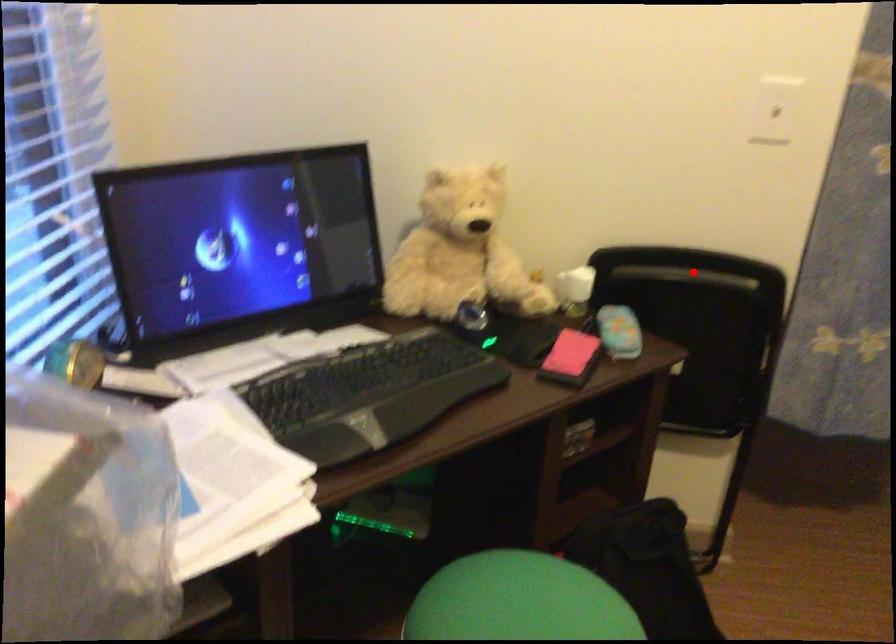
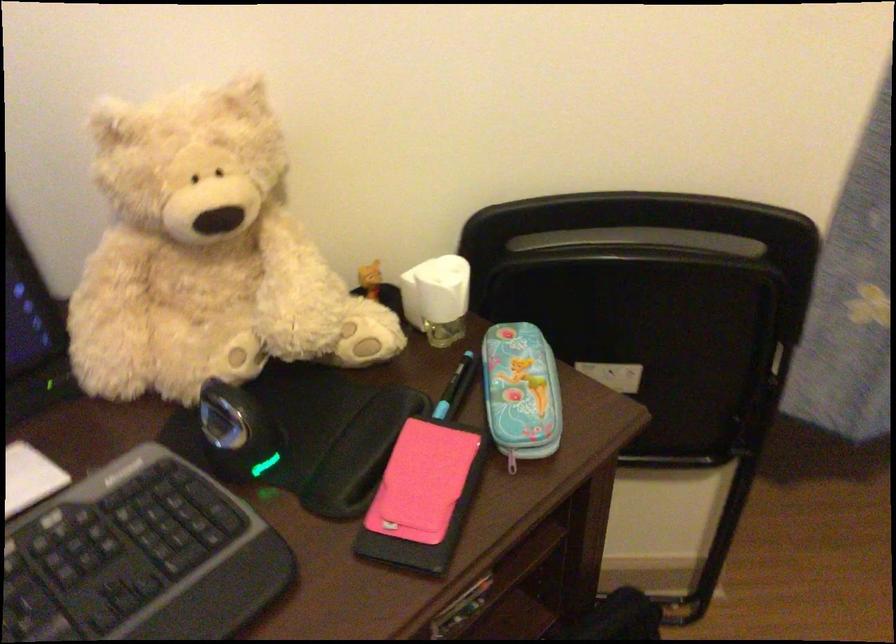
The point at the highlighted location is marked in the first image. Where is the corresponding point in the second image?

(642, 240)